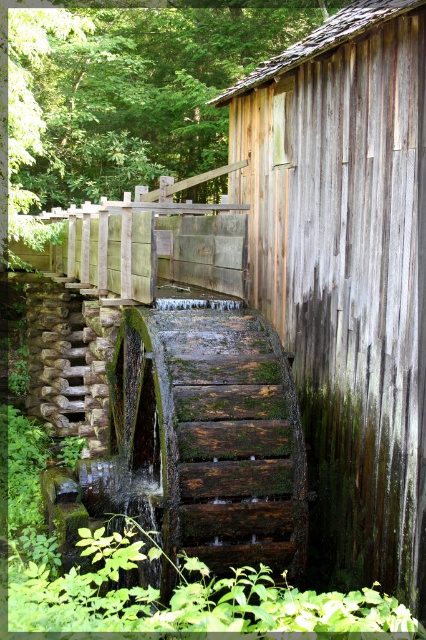
Question: Where is weathered wood hut at center-right located in relation to green mossy wood at center in the image?

Choices:
 (A) left
 (B) right

Answer: (B)

Question: Among these points, which one is farthest from the camera?

Choices:
 (A) (299, 540)
 (B) (348, 230)

Answer: (B)

Question: Which of the following is the farthest from the observer?

Choices:
 (A) green mossy wood at center
 (B) weathered wood hut at center-right

Answer: (A)

Question: Does weathered wood hut at center-right have a smaller size compared to green mossy wood at center?

Choices:
 (A) yes
 (B) no

Answer: (B)

Question: Is weathered wood hut at center-right positioned in front of green mossy wood at center?

Choices:
 (A) no
 (B) yes

Answer: (B)